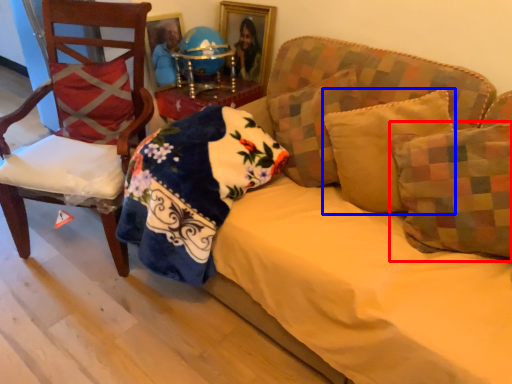
Question: Among these objects, which one is nearest to the camera, pillow (highlighted by a red box) or pillow (highlighted by a blue box)?

Choices:
 (A) pillow
 (B) pillow

Answer: (A)